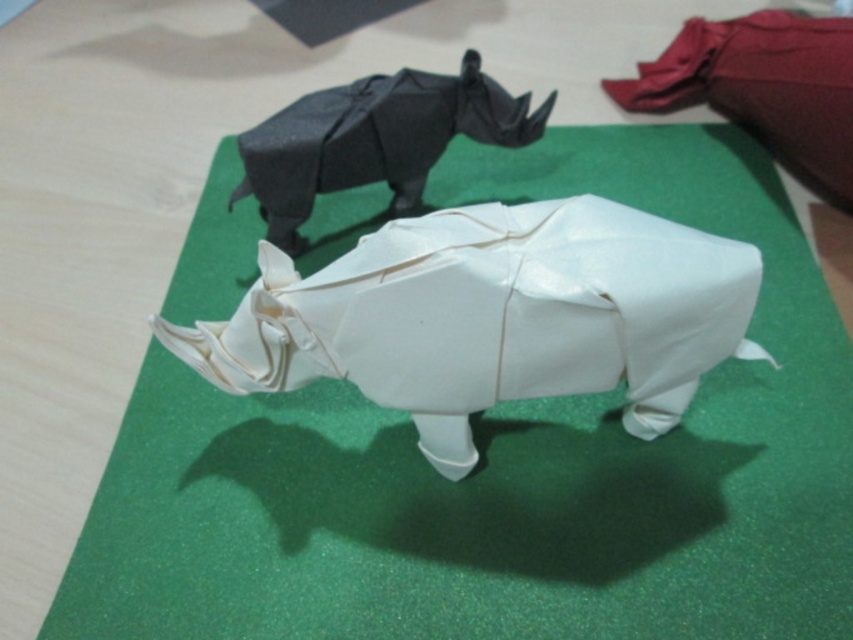
You are an art curator arranging an exhibition. You have two origami rhinoceros models displayed on a green surface. The white paper rhino at center and the black paper rhino at upper center. Which rhinoceros is positioned to the right of the other?

The white paper rhino at center is positioned on the right side of black paper rhino at upper center.